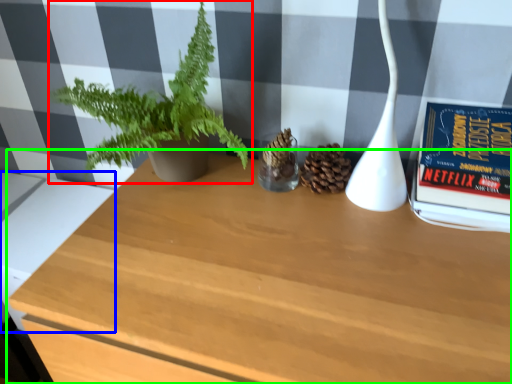
Question: Which is farther away from houseplant (highlighted by a red box)? table (highlighted by a blue box) or table (highlighted by a green box)?

Choices:
 (A) table
 (B) table

Answer: (A)